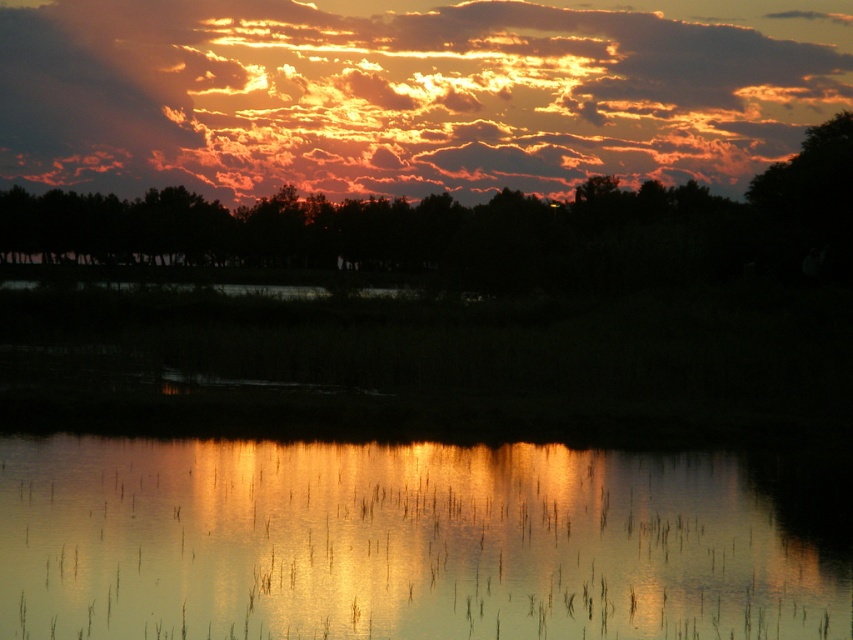
You are standing at the edge of the lake observing the sunset. You notice two points in the scene, one at coordinate point (317,451) and another at point (680,163). Which point is nearer to your current position?

Point (317,451) is closer to the camera than point (680,163), so the point at coordinate point (317,451) is nearer to your current position.

You are an artist painting the sunset scene. You want to ensure the glistening water at center and the golden textured clouds at upper center are proportionally accurate. Which object should you paint larger to maintain the scene as shown?

The golden textured clouds at upper center should be painted larger than the glistening water at center because the golden textured clouds at upper center are larger in the scene.